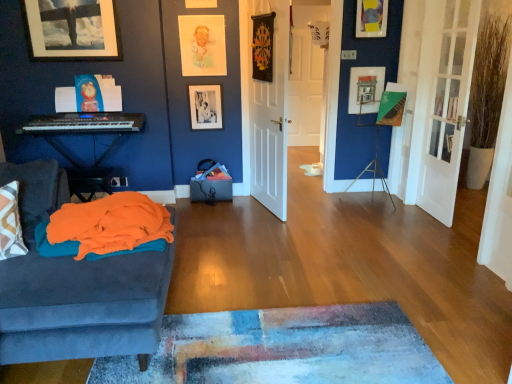
Locate an element on the screen. The height and width of the screenshot is (384, 512). free point to the left of white matte door at center, which ranks as the 2th door in front-to-back order is located at coordinates (224, 214).